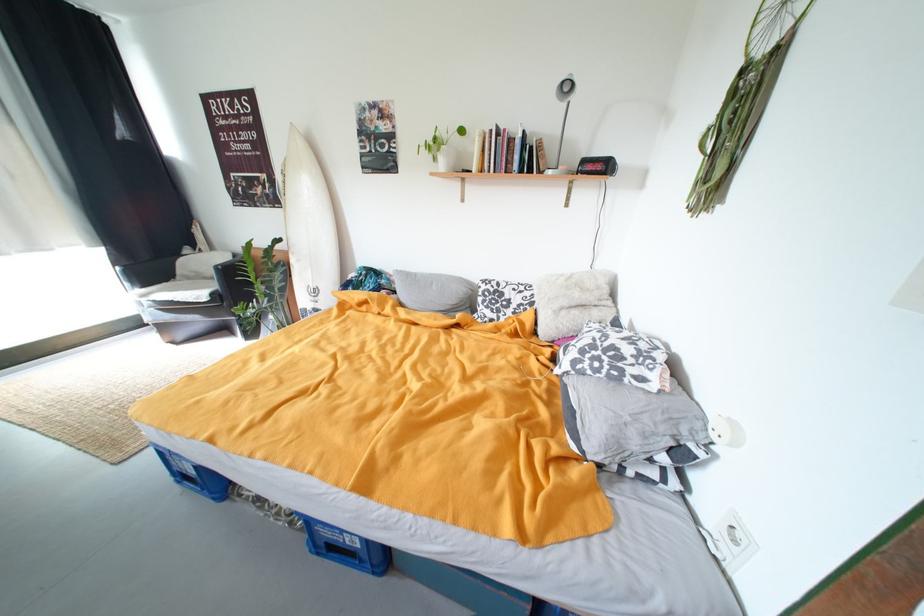
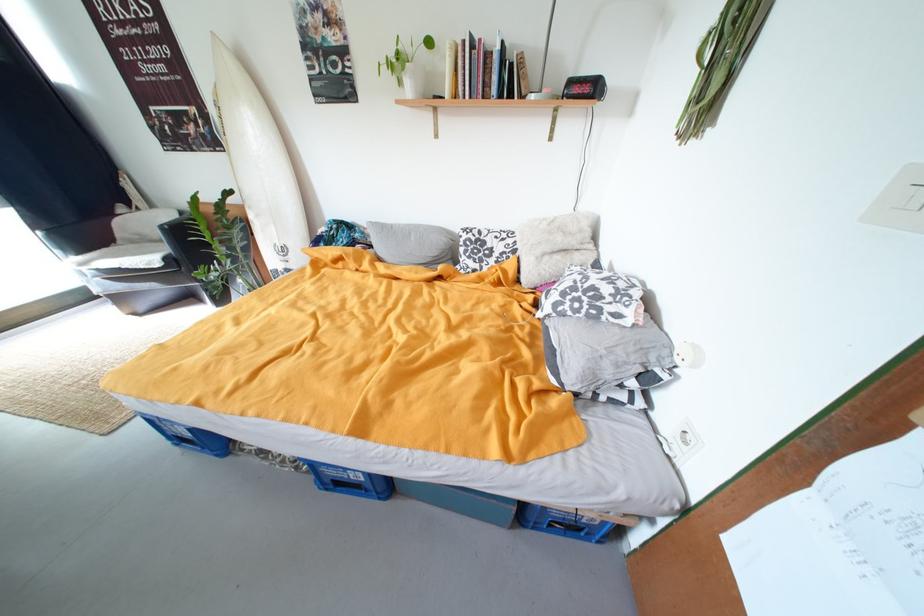
Locate, in the second image, the point that corresponds to point 608,169 in the first image.

(594, 91)